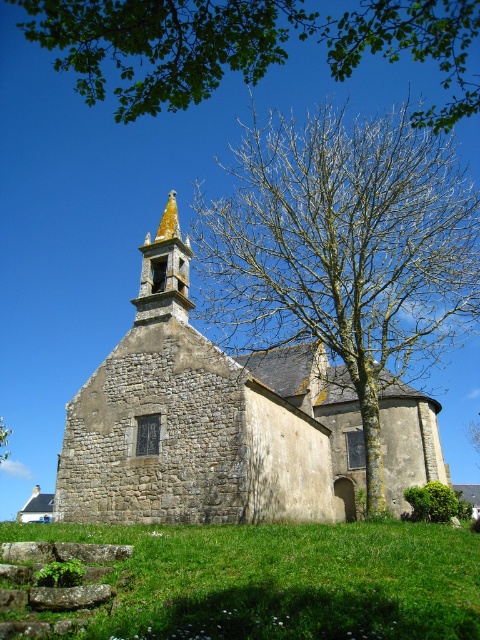
You are standing in front of the church and want to place a picnic blanket on the green grass at lower center. Considering the size of the green leafy tree at upper center, will there be enough space for the blanket without it being under the tree?

The green grass at lower center is smaller than the green leafy tree at upper center, so the grass area might be too small to accommodate the picnic blanket without overlapping under the tree.